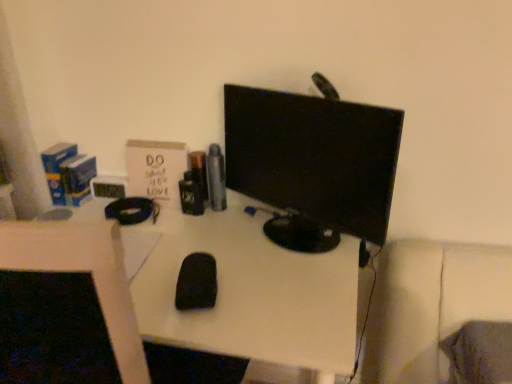
Question: Is black matte mouse at center at the back of black matte mouse at center?

Choices:
 (A) yes
 (B) no

Answer: (B)

Question: Is black matte mouse at center shorter than black matte mouse at center?

Choices:
 (A) no
 (B) yes

Answer: (A)

Question: Is the position of black matte mouse at center less distant than that of black matte mouse at center?

Choices:
 (A) no
 (B) yes

Answer: (B)

Question: From a real-world perspective, is black matte mouse at center positioned over black matte mouse at center based on gravity?

Choices:
 (A) yes
 (B) no

Answer: (B)

Question: Is black matte mouse at center directly adjacent to black matte mouse at center?

Choices:
 (A) yes
 (B) no

Answer: (B)

Question: Considering their positions, is black matte mouse at center located in front of or behind black glossy monitor at center?

Choices:
 (A) behind
 (B) front

Answer: (A)

Question: Considering the positions of point (181, 273) and point (367, 158), is point (181, 273) closer or farther from the camera than point (367, 158)?

Choices:
 (A) closer
 (B) farther

Answer: (B)

Question: Is black matte mouse at center taller or shorter than black glossy monitor at center?

Choices:
 (A) tall
 (B) short

Answer: (B)

Question: Do you think black matte mouse at center is within black glossy monitor at center, or outside of it?

Choices:
 (A) inside
 (B) outside

Answer: (B)

Question: Is black glossy monitor at center wider or thinner than black matte mouse at center?

Choices:
 (A) thin
 (B) wide

Answer: (A)

Question: From the image's perspective, is black glossy monitor at center located above or below black matte mouse at center?

Choices:
 (A) above
 (B) below

Answer: (A)

Question: In the image, is black glossy monitor at center positioned in front of or behind black matte mouse at center?

Choices:
 (A) behind
 (B) front

Answer: (B)

Question: Is point (261, 162) closer or farther from the camera than point (209, 288)?

Choices:
 (A) closer
 (B) farther

Answer: (B)

Question: Is point (96, 286) positioned closer to the camera than point (389, 145)?

Choices:
 (A) farther
 (B) closer

Answer: (B)

Question: From a real-world perspective, is black matte mouse at center positioned above or below black glossy monitor at center?

Choices:
 (A) below
 (B) above

Answer: (A)